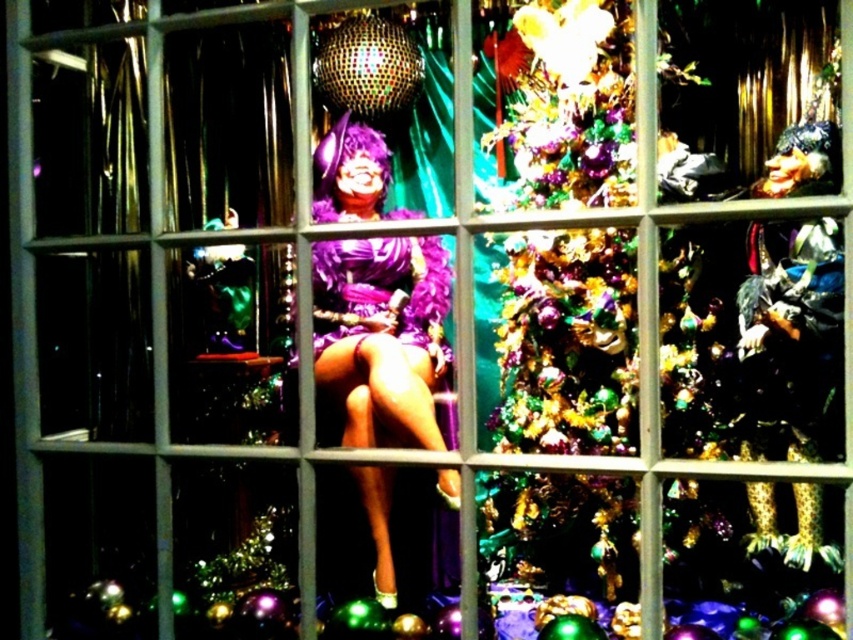
Which of these two, shiny gold tinsel at center or purple feathered dress at center, stands shorter?

purple feathered dress at center

Identify the location of shiny gold tinsel at center. (567, 342).

Which is below, shiny gold tinsel at center or purple satin dress at center?

shiny gold tinsel at center

Can you confirm if shiny gold tinsel at center is shorter than purple satin dress at center?

In fact, shiny gold tinsel at center may be taller than purple satin dress at center.

What do you see at coordinates (567, 342) in the screenshot?
I see `shiny gold tinsel at center` at bounding box center [567, 342].

Where is `shiny gold tinsel at center`? This screenshot has height=640, width=853. shiny gold tinsel at center is located at coordinates (567, 342).

Can you confirm if purple feathered dress at center is positioned to the right of purple satin dress at center?

Incorrect, purple feathered dress at center is not on the right side of purple satin dress at center.

Does purple feathered dress at center lie behind purple satin dress at center?

No.

You are a GUI agent. You are given a task and a screenshot of the screen. Output one action in this format:
    pyautogui.click(x=<x>, y=<y>)
    Task: Click on the purple feathered dress at center
    This screenshot has width=853, height=640.
    Given the screenshot: What is the action you would take?
    pyautogui.click(x=383, y=339)

Locate an element on the screen. The image size is (853, 640). purple feathered dress at center is located at coordinates (383, 339).